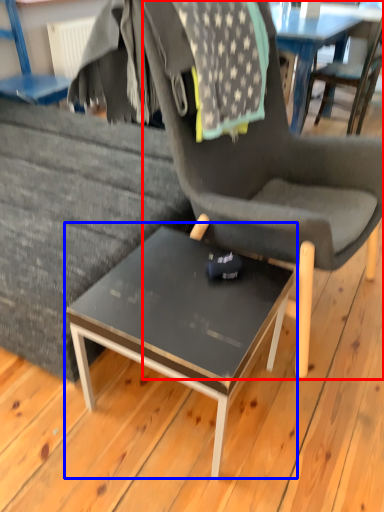
Question: Among these objects, which one is nearest to the camera, chair (highlighted by a red box) or coffee table (highlighted by a blue box)?

Choices:
 (A) chair
 (B) coffee table

Answer: (A)